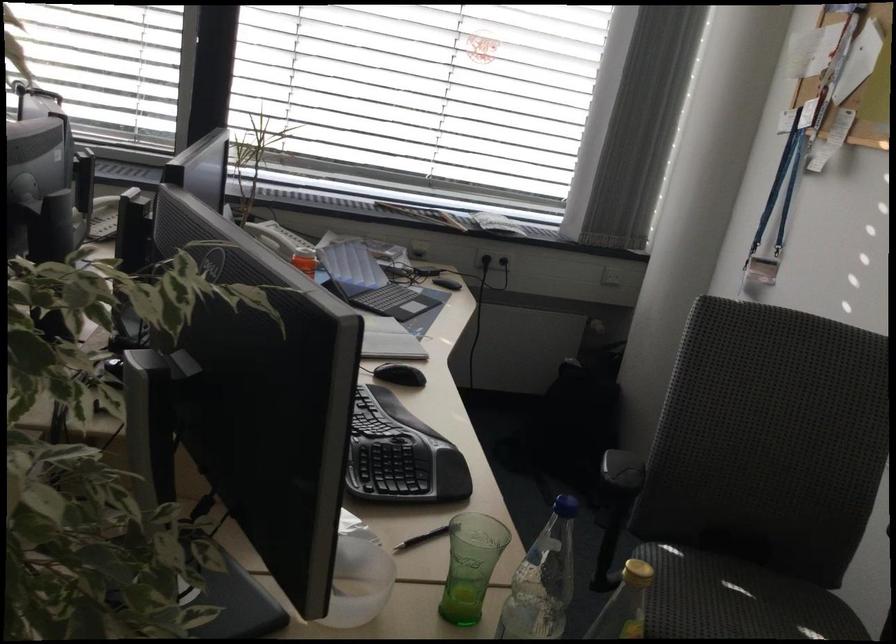
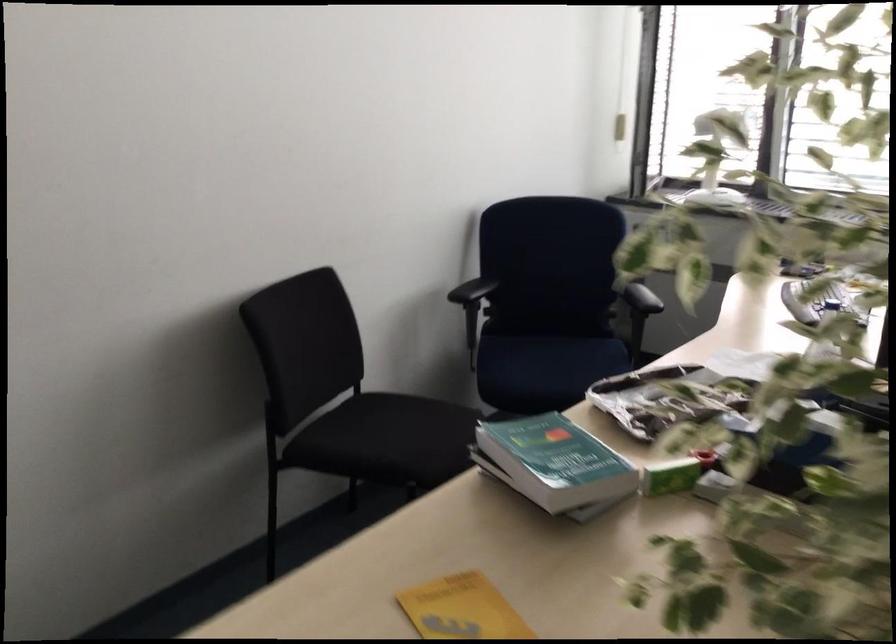
Question: The camera is either moving clockwise (left) or counter-clockwise (right) around the object. The first image is from the beginning of the video and the second image is from the end. Is the camera moving left or right when shooting the video?

Choices:
 (A) Left
 (B) Right

Answer: (B)